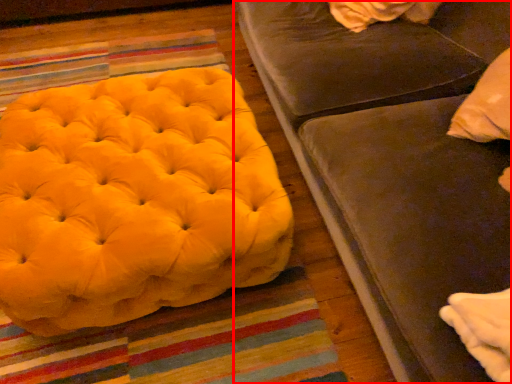
Question: From the image's perspective, considering the relative positions of studio couch (annotated by the red box) and furniture in the image provided, where is studio couch (annotated by the red box) located with respect to the staircase?

Choices:
 (A) above
 (B) below

Answer: (A)